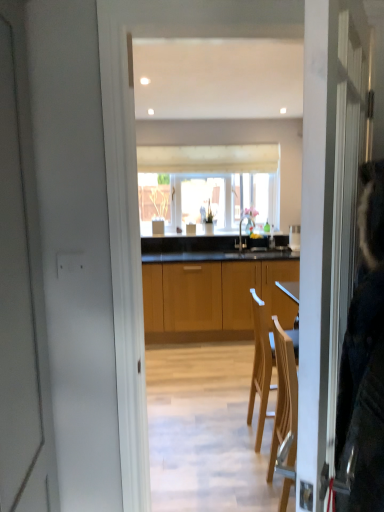
Question: Does white fabric window at center lie behind matte silver faucet at center?

Choices:
 (A) no
 (B) yes

Answer: (B)

Question: Can you see white fabric window at center touching matte silver faucet at center?

Choices:
 (A) no
 (B) yes

Answer: (A)

Question: Is matte silver faucet at center at the back of white fabric window at center?

Choices:
 (A) no
 (B) yes

Answer: (A)

Question: Is white fabric window at center taller than matte silver faucet at center?

Choices:
 (A) no
 (B) yes

Answer: (B)

Question: Is white fabric window at center surrounding matte silver faucet at center?

Choices:
 (A) no
 (B) yes

Answer: (A)

Question: Are white fabric window at center and matte silver faucet at center far apart?

Choices:
 (A) no
 (B) yes

Answer: (A)

Question: From the image's perspective, is matte silver faucet at center located beneath wooden cabinets at center?

Choices:
 (A) no
 (B) yes

Answer: (A)

Question: From a real-world perspective, is matte silver faucet at center beneath wooden cabinets at center?

Choices:
 (A) yes
 (B) no

Answer: (B)

Question: Can you confirm if matte silver faucet at center is shorter than wooden cabinets at center?

Choices:
 (A) yes
 (B) no

Answer: (A)

Question: Is matte silver faucet at center facing towards wooden cabinets at center?

Choices:
 (A) no
 (B) yes

Answer: (A)

Question: Does matte silver faucet at center have a greater width compared to wooden cabinets at center?

Choices:
 (A) yes
 (B) no

Answer: (B)

Question: Is the position of matte silver faucet at center more distant than that of wooden cabinets at center?

Choices:
 (A) yes
 (B) no

Answer: (A)

Question: Does wooden cabinets at center have a lesser height compared to white fabric window at center?

Choices:
 (A) yes
 (B) no

Answer: (B)